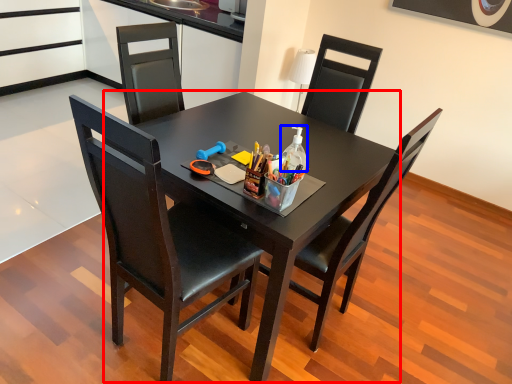
Question: Which object appears closest to the camera in this image, round table (highlighted by a red box) or bottle (highlighted by a blue box)?

Choices:
 (A) round table
 (B) bottle

Answer: (A)